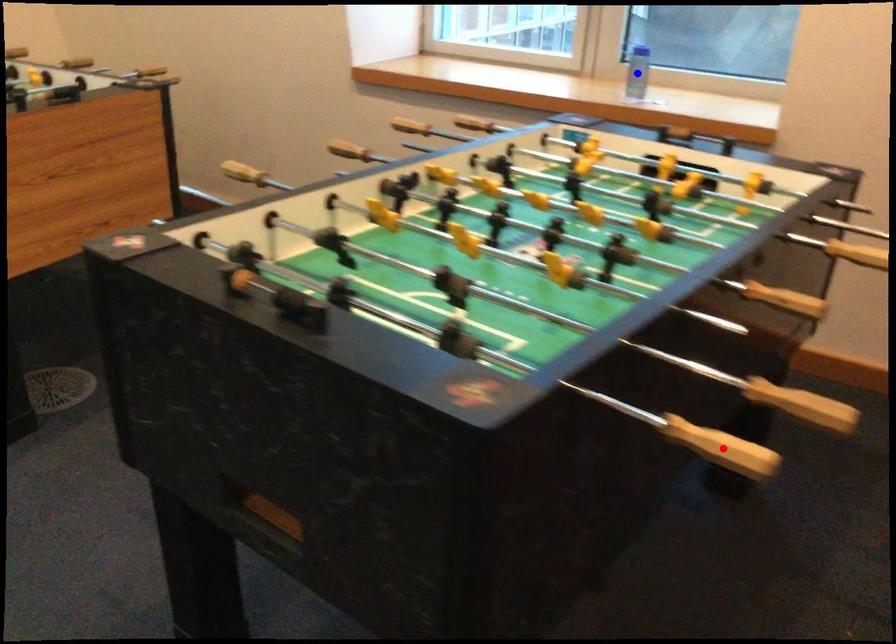
Question: Which of the two points in the image is closer to the camera?

Choices:
 (A) Blue point is closer.
 (B) Red point is closer.

Answer: (B)